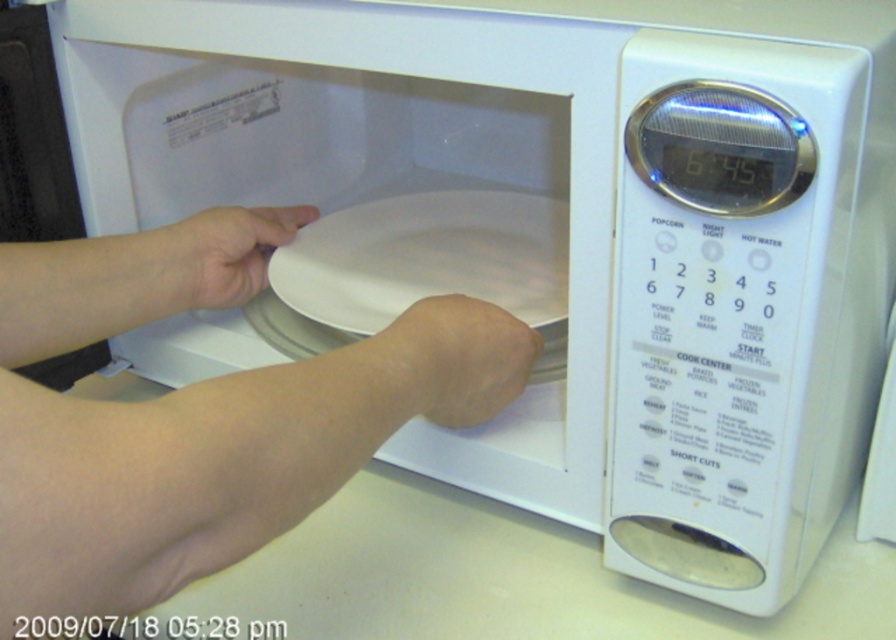
Question: Among these points, which one is farthest from the camera?

Choices:
 (A) (238, 429)
 (B) (394, 392)
 (C) (157, 228)

Answer: (C)

Question: In this image, where is white matte plate at center located relative to skinny flesh at lower center?

Choices:
 (A) above
 (B) below

Answer: (A)

Question: Considering the real-world distances, which object is farthest from the skinny white arm at center?

Choices:
 (A) white matte plate at center
 (B) white matte plate at left
 (C) skinny flesh at lower center

Answer: (A)

Question: From the image, what is the correct spatial relationship of skinny white arm at center in relation to skinny flesh at lower center?

Choices:
 (A) above
 (B) below

Answer: (A)

Question: Which of the following is the farthest from the observer?

Choices:
 (A) skinny flesh at lower center
 (B) white matte plate at center

Answer: (B)

Question: Is skinny flesh at lower center above white matte plate at left?

Choices:
 (A) yes
 (B) no

Answer: (B)